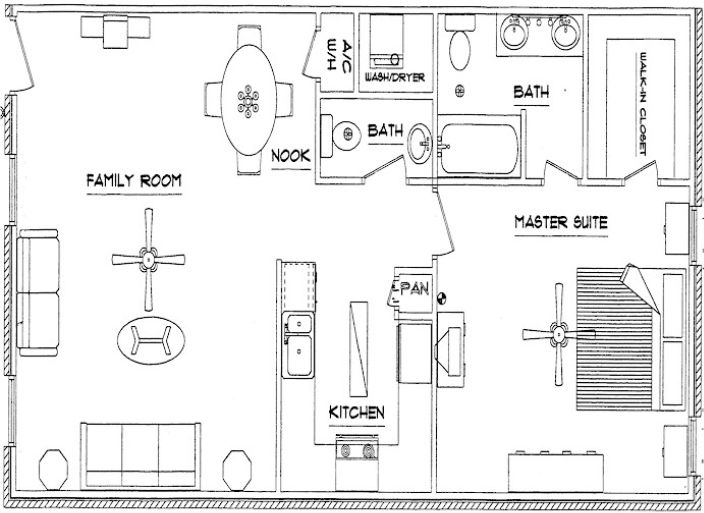
Identify the location of ceiling fan. The height and width of the screenshot is (513, 704). (146, 255), (558, 336).